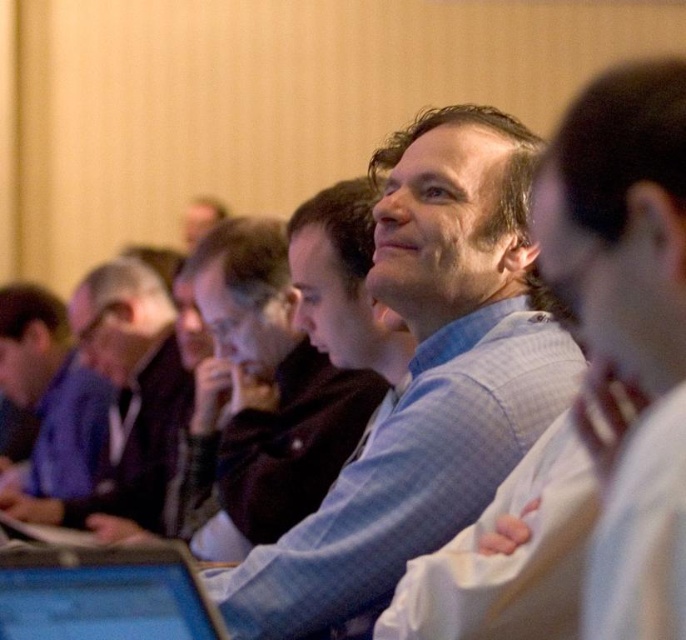
Question: Is the position of blue plaid shirt at center more distant than that of blue glossy laptop at center?

Choices:
 (A) yes
 (B) no

Answer: (B)

Question: Which object is the closest to the blue fabric jacket at left?

Choices:
 (A) blue plaid shirt at center
 (B) matte blue shirt at left
 (C) blue checkered shirt at center
 (D) blue glossy laptop at center

Answer: (B)

Question: Is blue plaid shirt at center in front of matte blue shirt at left?

Choices:
 (A) yes
 (B) no

Answer: (A)

Question: Which point is closer to the camera?

Choices:
 (A) (8, 621)
 (B) (139, 280)
 (C) (348, 490)
 (D) (536, 593)

Answer: (A)

Question: Does blue plaid shirt at center come behind blue fabric jacket at left?

Choices:
 (A) no
 (B) yes

Answer: (A)

Question: Which point is closer to the camera taking this photo?

Choices:
 (A) (134, 449)
 (B) (582, 602)
 (C) (59, 417)
 (D) (407, 150)

Answer: (B)